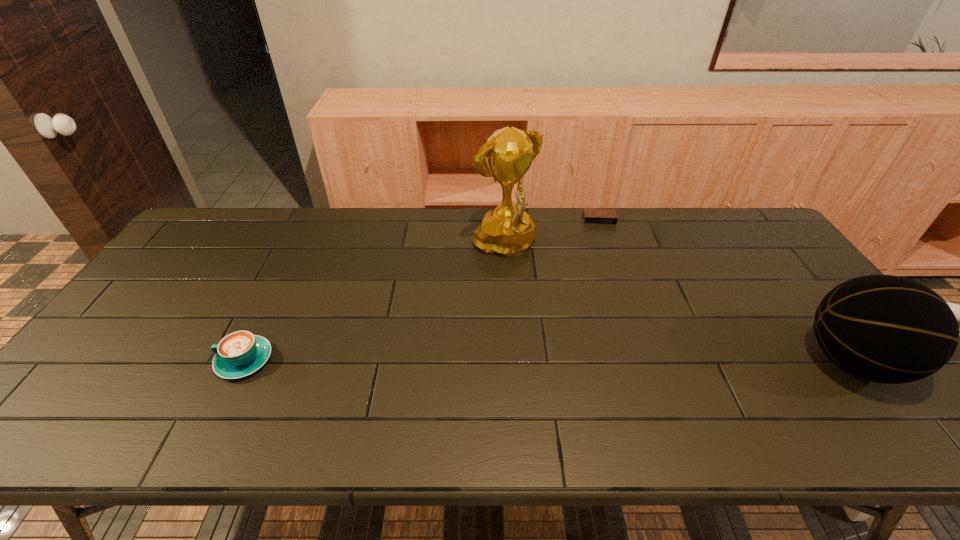
The height and width of the screenshot is (540, 960). Find the location of `vacant spot on the desktop that is between the leftmost object and the rightmost object and is positioned on the front side of the third object from right to left`. vacant spot on the desktop that is between the leftmost object and the rightmost object and is positioned on the front side of the third object from right to left is located at coordinates (637, 361).

At what (x,y) coordinates should I click in order to perform the action: click on vacant space on the desktop that is between the cappuccino and the basketball and is positioned on the front face of the second object from right to left. Please return your answer as a coordinate pair (x, y). Looking at the image, I should click on (635, 361).